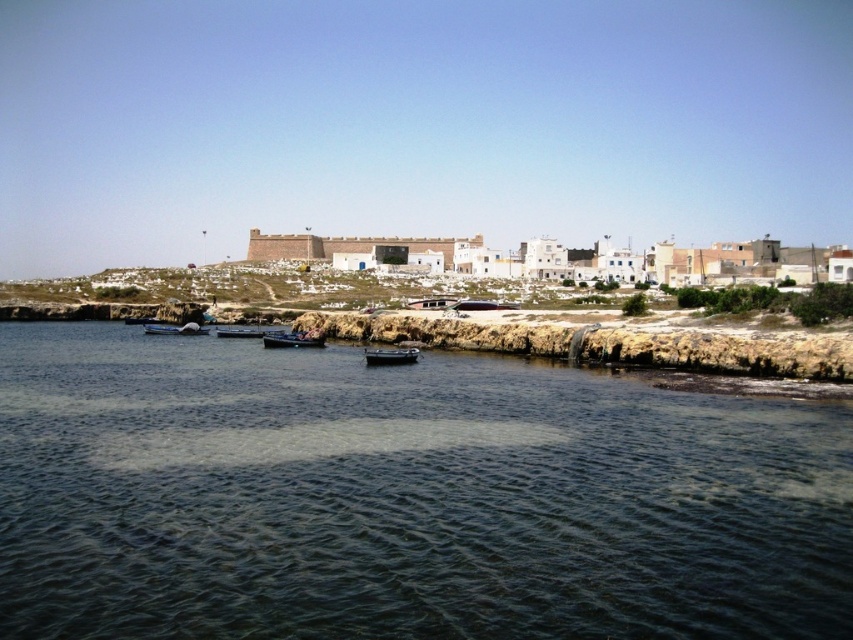
Question: Does dark green water at center appear over wooden boat at center?

Choices:
 (A) yes
 (B) no

Answer: (B)

Question: Does black rubber boat at lower center have a larger size compared to wooden boat at center?

Choices:
 (A) no
 (B) yes

Answer: (A)

Question: Estimate the real-world distances between objects in this image. Which object is closer to the wooden boat at center?

Choices:
 (A) black rubber boat at lower center
 (B) wooden boat at lower left
 (C) dark green water at center

Answer: (B)

Question: Is dark green water at center to the left of smooth wooden boat at center from the viewer's perspective?

Choices:
 (A) yes
 (B) no

Answer: (B)

Question: Which point is farther to the camera?

Choices:
 (A) wooden boat at center
 (B) black rubber boat at lower center

Answer: (A)

Question: Which object is the farthest from the dark green water at center?

Choices:
 (A) black rubber boat at lower center
 (B) wooden boat at lower left
 (C) smooth wooden boat at center
 (D) wooden boat at center

Answer: (B)